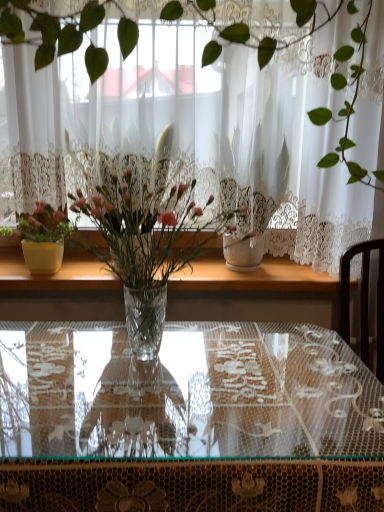
Image resolution: width=384 pixels, height=512 pixels. In order to click on vacant space situated above transparent glass table at center (from a real-world perspective) in this screenshot , I will do `click(120, 362)`.